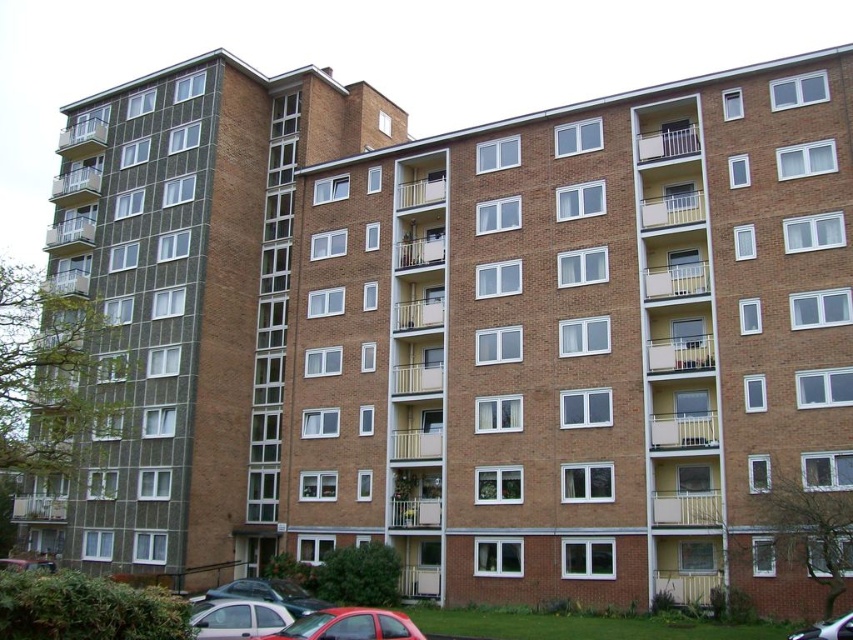
Is metallic silver car at lower right bigger than metallic silver car at lower left?

Yes.

Is the position of metallic silver car at lower right less distant than that of metallic silver car at lower left?

Yes, it is in front of metallic silver car at lower left.

Between point (813, 637) and point (48, 561), which one is positioned behind?

The point (48, 561) is more distant.

Find the location of a particular element. The image size is (853, 640). metallic silver car at lower right is located at coordinates (827, 628).

Does point (314, 598) come behind point (1, 557)?

No.

What do you see at coordinates (270, 593) in the screenshot? This screenshot has height=640, width=853. I see `metallic silver car at lower center` at bounding box center [270, 593].

Locate an element on the screen. metallic silver car at lower center is located at coordinates (270, 593).

This screenshot has height=640, width=853. Identify the location of metallic silver car at lower center. (270, 593).

Consider the image. Is metallic silver car at lower center further to the viewer compared to metallic silver car at lower right?

That is True.

The width and height of the screenshot is (853, 640). What do you see at coordinates (270, 593) in the screenshot?
I see `metallic silver car at lower center` at bounding box center [270, 593].

Between point (242, 579) and point (827, 637), which one is positioned behind?

Point (242, 579)

At what (x,y) coordinates should I click in order to perform the action: click on metallic silver car at lower center. Please return your answer as a coordinate pair (x, y). Looking at the image, I should click on (270, 593).